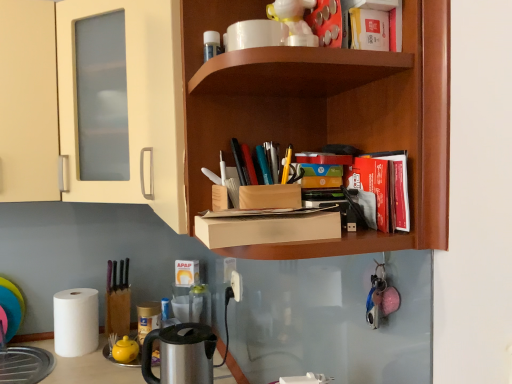
Question: Are white plastic electric outlet at lower center and red matte book at upper right, the first book positioned from the top, far apart?

Choices:
 (A) no
 (B) yes

Answer: (B)

Question: From the image's perspective, would you say white plastic electric outlet at lower center is positioned over red matte book at upper right, the first book positioned from the top?

Choices:
 (A) no
 (B) yes

Answer: (A)

Question: Is white plastic electric outlet at lower center located outside red matte book at upper right, acting as the 3th book starting from the bottom?

Choices:
 (A) no
 (B) yes

Answer: (B)

Question: Considering the relative positions of white plastic electric outlet at lower center and red matte book at upper right, the first book positioned from the top, in the image provided, is white plastic electric outlet at lower center behind red matte book at upper right, the first book positioned from the top,?

Choices:
 (A) yes
 (B) no

Answer: (A)

Question: Does white plastic electric outlet at lower center have a greater height compared to red matte book at upper right, acting as the 3th book starting from the bottom?

Choices:
 (A) yes
 (B) no

Answer: (B)

Question: Considering the relative sizes of white plastic electric outlet at lower center and red matte book at upper right, the first book positioned from the top, in the image provided, is white plastic electric outlet at lower center wider than red matte book at upper right, the first book positioned from the top,?

Choices:
 (A) yes
 (B) no

Answer: (A)

Question: Can you confirm if red matte book at upper right, which is the second book from top to bottom, is shorter than red matte book at upper right, the first book positioned from the top?

Choices:
 (A) yes
 (B) no

Answer: (A)

Question: Can you confirm if red matte book at upper right, placed as the 2th book when sorted from bottom to top, is bigger than red matte book at upper right, the first book positioned from the top?

Choices:
 (A) no
 (B) yes

Answer: (B)

Question: Is red matte book at upper right, placed as the 2th book when sorted from bottom to top, at the left side of red matte book at upper right, the first book positioned from the top?

Choices:
 (A) yes
 (B) no

Answer: (B)

Question: Is red matte book at upper right, placed as the 2th book when sorted from bottom to top, thinner than red matte book at upper right, acting as the 3th book starting from the bottom?

Choices:
 (A) no
 (B) yes

Answer: (A)

Question: Is red matte book at upper right, which is the second book from top to bottom, next to red matte book at upper right, acting as the 3th book starting from the bottom, and touching it?

Choices:
 (A) yes
 (B) no

Answer: (B)

Question: Is red matte book at upper right, which is the second book from top to bottom, taller than red matte book at upper right, acting as the 3th book starting from the bottom?

Choices:
 (A) no
 (B) yes

Answer: (A)

Question: Is white matte paper towel at lower left not inside white glossy coffee cup at upper center?

Choices:
 (A) yes
 (B) no

Answer: (A)